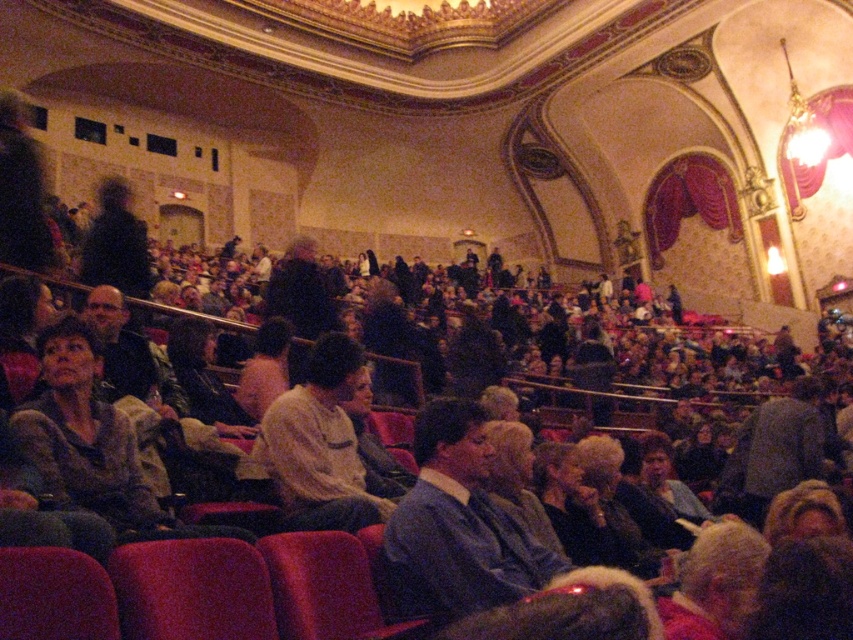
You are sitting in the theater and want to discreetly pass a note to the person wearing the light beige shirt at center without the person wearing the blue sweater at center noticing. Which direction should you pass the note?

You should pass the note to the left, as the blue sweater at center is to the right of the light beige shirt at center, so passing to the left would avoid the blue sweater at center noticing.

Consider the image. You are sitting in the theater and want to see the stage clearly. There are two people in front of you wearing a blue sweater at center and a light beige shirt at center. Which person is blocking your view more?

The blue sweater at center is blocking your view more because it is in front of the light beige shirt at center.